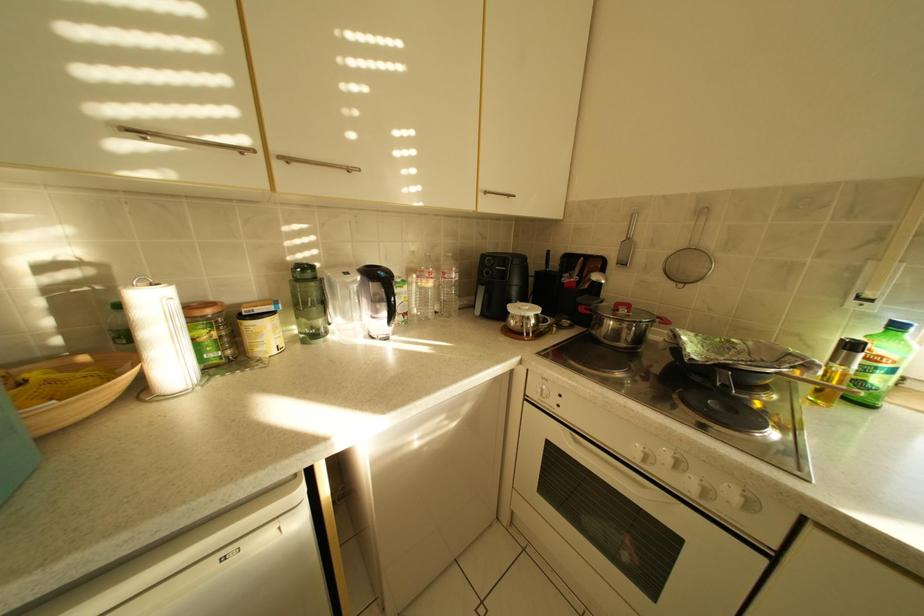
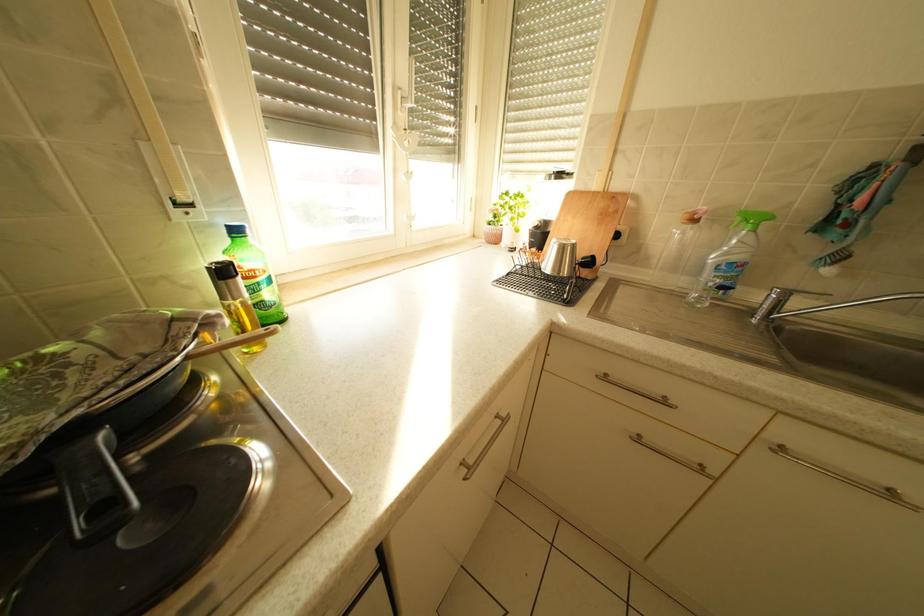
Based on the continuous images, in which direction is the camera rotating?

The rotation direction of the camera is right-down.